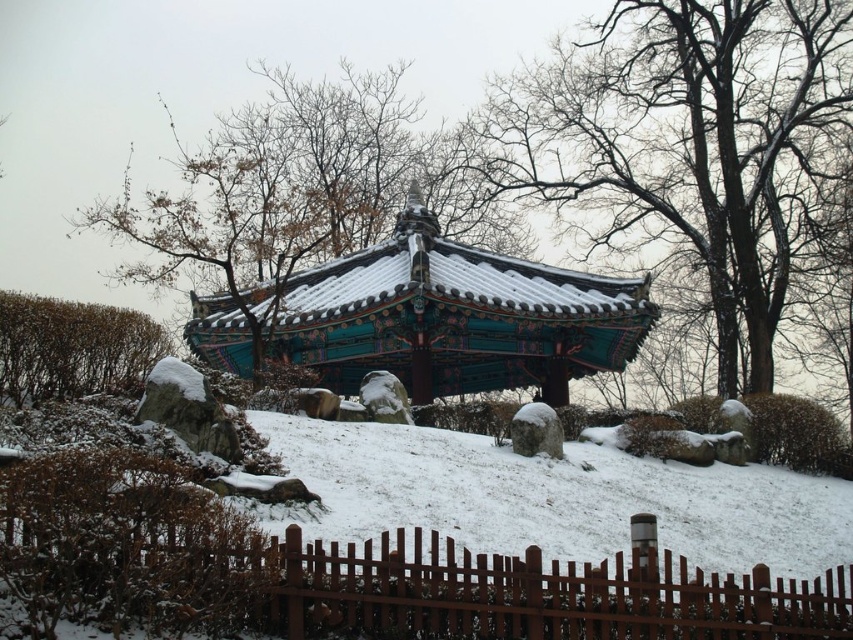
Question: Among these objects, which one is farthest from the camera?

Choices:
 (A) green wooden pavilion at center
 (B) brown wooden fence at lower center
 (C) teal wooden pavilion at center

Answer: (A)

Question: Does brown wooden fence at lower center have a greater width compared to green leafy bush at left?

Choices:
 (A) yes
 (B) no

Answer: (A)

Question: Can you confirm if green wooden pavilion at center is thinner than brown wooden fence at lower center?

Choices:
 (A) no
 (B) yes

Answer: (A)

Question: Which of the following is the farthest from the observer?

Choices:
 (A) (93, 372)
 (B) (747, 218)
 (C) (73, 577)
 (D) (640, 336)

Answer: (B)

Question: Based on their relative distances, which object is nearer to the green wooden pavilion at center?

Choices:
 (A) green leafy bush at left
 (B) brown wooden fence at lower center

Answer: (B)

Question: In this image, where is brown wooden fence at lower center located relative to teal wooden pavilion at center?

Choices:
 (A) above
 (B) below

Answer: (B)